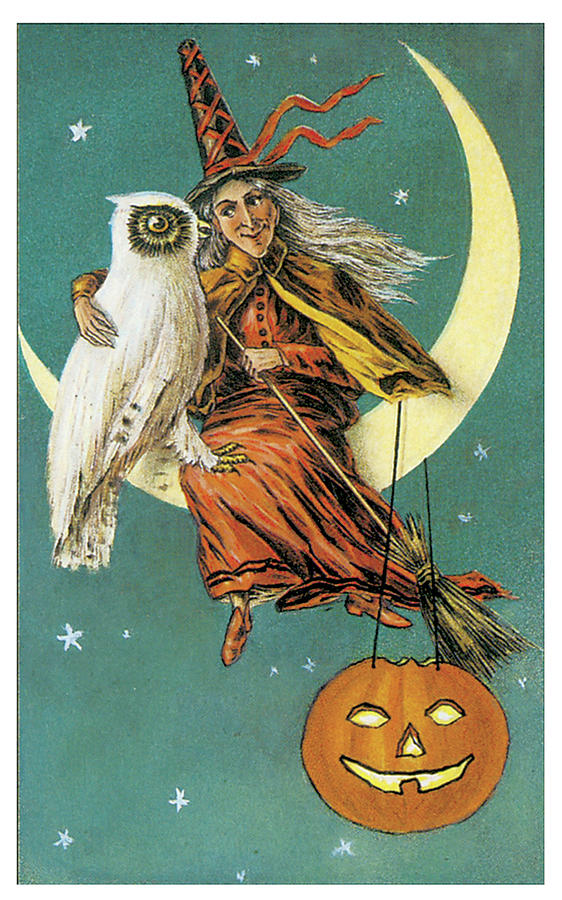
Where is `broom`? broom is located at coordinates (478, 631).